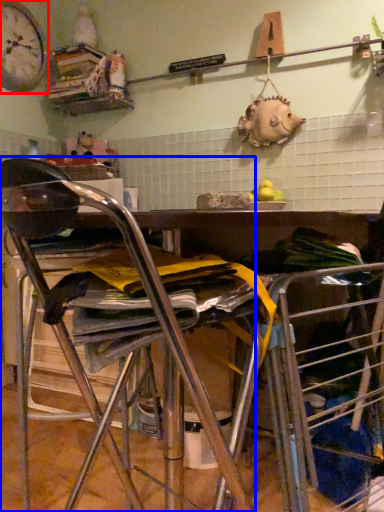
Question: Among these objects, which one is farthest to the camera, clock (highlighted by a red box) or chair (highlighted by a blue box)?

Choices:
 (A) clock
 (B) chair

Answer: (A)